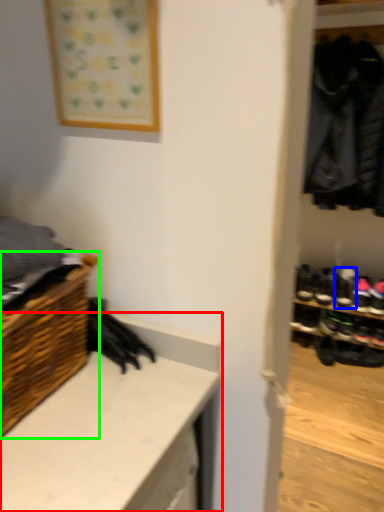
Question: Estimate the real-world distances between objects in this image. Which object is closer to counter (highlighted by a red box), footwear (highlighted by a blue box) or shelf (highlighted by a green box)?

Choices:
 (A) footwear
 (B) shelf

Answer: (B)